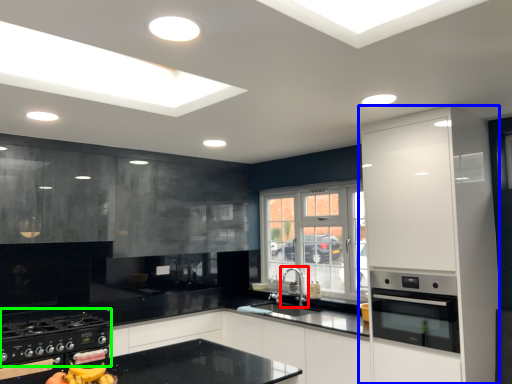
Question: Estimate the real-world distances between objects in this image. Which object is closer to tap (highlighted by a red box), cabinetry (highlighted by a blue box) or gas stove (highlighted by a green box)?

Choices:
 (A) cabinetry
 (B) gas stove

Answer: (A)